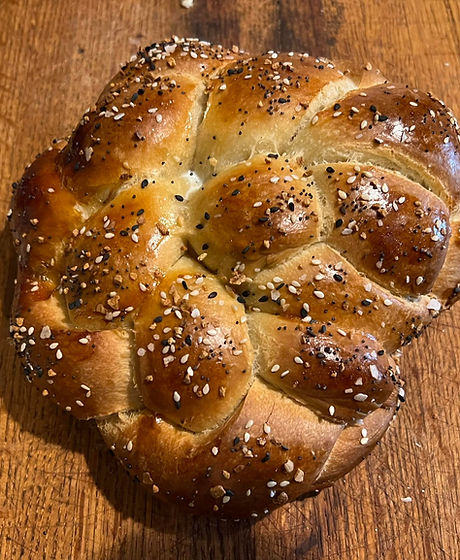
Locate an element on the screen. open brown tabletop space, top left corner is located at coordinates (37, 110), (114, 36), (30, 44).